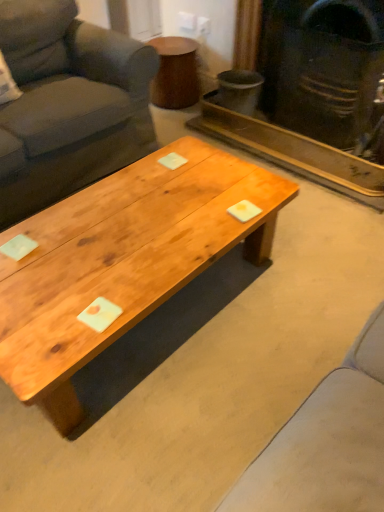
Question: Is wooden side table at upper center positioned beyond the bounds of matte black fireplace at upper right?

Choices:
 (A) yes
 (B) no

Answer: (A)

Question: Does wooden side table at upper center appear on the left side of matte black fireplace at upper right?

Choices:
 (A) no
 (B) yes

Answer: (B)

Question: Is wooden side table at upper center taller than matte black fireplace at upper right?

Choices:
 (A) yes
 (B) no

Answer: (B)

Question: From a real-world perspective, does wooden side table at upper center sit lower than matte black fireplace at upper right?

Choices:
 (A) yes
 (B) no

Answer: (A)

Question: Is the surface of wooden side table at upper center in direct contact with matte black fireplace at upper right?

Choices:
 (A) no
 (B) yes

Answer: (A)

Question: Considering their positions, is matte black fireplace at upper right located in front of or behind natural wood coffee table at center?

Choices:
 (A) behind
 (B) front

Answer: (A)

Question: From the image's perspective, is matte black fireplace at upper right located above or below natural wood coffee table at center?

Choices:
 (A) above
 (B) below

Answer: (A)

Question: In terms of size, does matte black fireplace at upper right appear bigger or smaller than natural wood coffee table at center?

Choices:
 (A) big
 (B) small

Answer: (B)

Question: Is matte black fireplace at upper right wider or thinner than natural wood coffee table at center?

Choices:
 (A) thin
 (B) wide

Answer: (A)

Question: From a real-world perspective, relative to wooden side table at upper center, is matte black fireplace at upper right vertically above or below?

Choices:
 (A) below
 (B) above

Answer: (B)

Question: Looking at their shapes, would you say matte black fireplace at upper right is wider or thinner than wooden side table at upper center?

Choices:
 (A) wide
 (B) thin

Answer: (B)

Question: Considering the positions of matte black fireplace at upper right and wooden side table at upper center in the image, is matte black fireplace at upper right taller or shorter than wooden side table at upper center?

Choices:
 (A) tall
 (B) short

Answer: (A)

Question: From the image's perspective, is matte black fireplace at upper right above or below wooden side table at upper center?

Choices:
 (A) above
 (B) below

Answer: (B)

Question: Considering their positions, is wooden side table at upper center located in front of or behind matte black fireplace at upper right?

Choices:
 (A) front
 (B) behind

Answer: (B)

Question: Is wooden side table at upper center wider or thinner than matte black fireplace at upper right?

Choices:
 (A) wide
 (B) thin

Answer: (A)